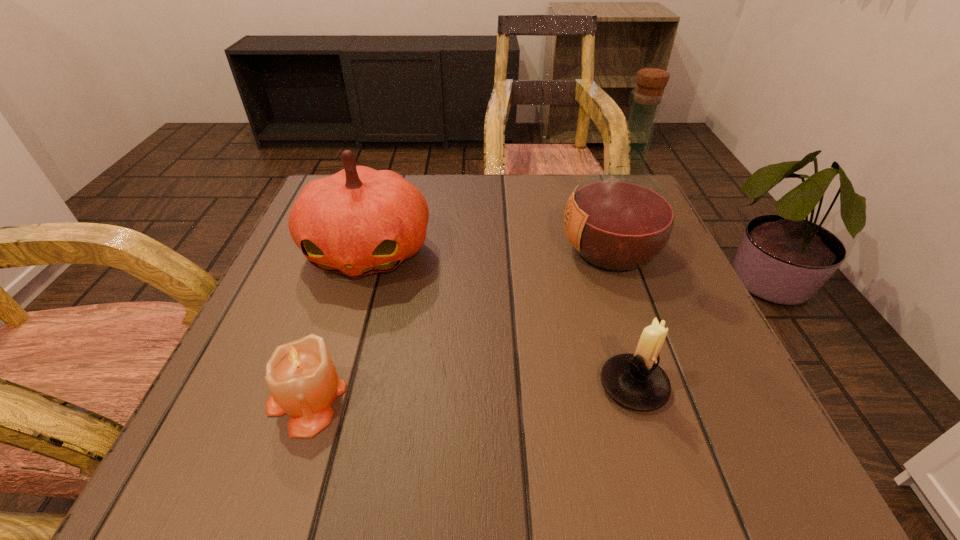
I want to click on empty space between the candle and the pumpkin, so click(337, 325).

The width and height of the screenshot is (960, 540). In order to click on free space between the liquor and the candle holder in this screenshot , I will do `click(622, 319)`.

Find the location of a particular element. The height and width of the screenshot is (540, 960). unoccupied position between the tallest object and the shortest object is located at coordinates (458, 325).

Where is `blank region between the tallest object and the shortest object`? This screenshot has width=960, height=540. blank region between the tallest object and the shortest object is located at coordinates (458, 325).

At what (x,y) coordinates should I click in order to perform the action: click on free spot between the shortest object and the liquor. Please return your answer as a coordinate pair (x, y). The image size is (960, 540). Looking at the image, I should click on (458, 325).

Find the location of `free space between the shortest object and the third tallest object`. free space between the shortest object and the third tallest object is located at coordinates (469, 392).

The image size is (960, 540). I want to click on free space that is in between the candle and the candle holder, so click(x=469, y=392).

Select which object is the closest to the liquor. Please provide its 2D coordinates. Your answer should be formatted as a tuple, i.e. [(x, y)], where the tuple contains the x and y coordinates of a point satisfying the conditions above.

[(636, 381)]

Find the location of `object that ranks as the second closest to the pumpkin`. object that ranks as the second closest to the pumpkin is located at coordinates (619, 219).

Find the location of a particular element. vacant area that satisfies the following two spatial constraints: 1. on the front-facing side of the second shortest object; 2. on the right side of the pumpkin is located at coordinates (326, 386).